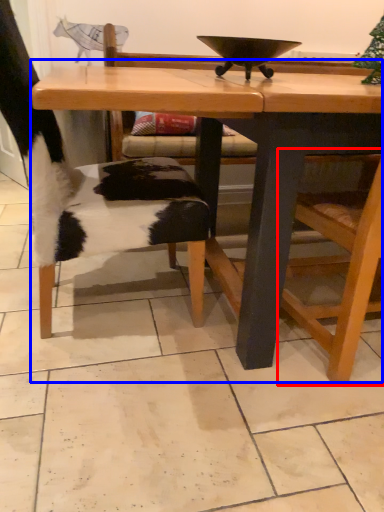
Question: Which object is closer to the camera taking this photo, armchair (highlighted by a red box) or table (highlighted by a blue box)?

Choices:
 (A) armchair
 (B) table

Answer: (A)